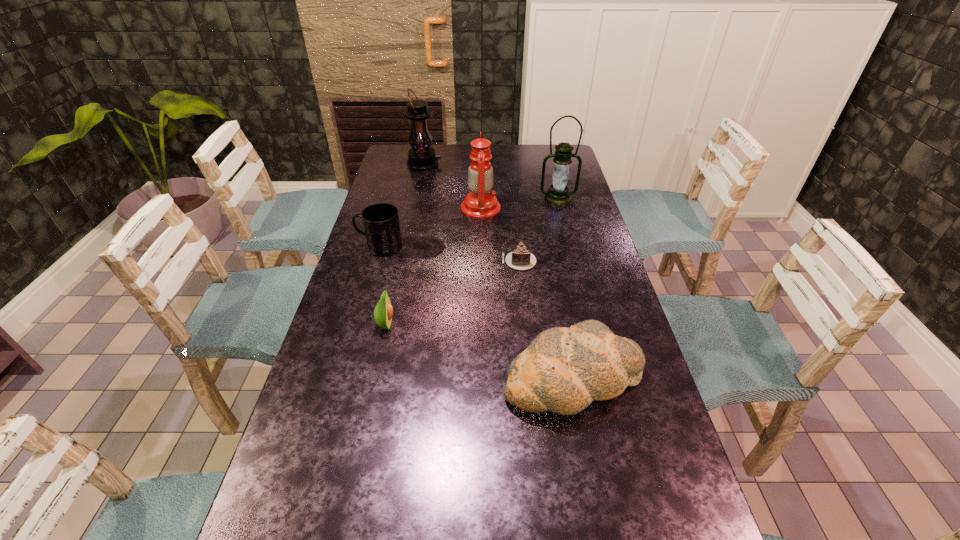
Locate an element on the screen. The height and width of the screenshot is (540, 960). vacant point located between the right lantern and the chocolate cake is located at coordinates (539, 230).

Choose which object is the fourth nearest neighbor to the mug. Please provide its 2D coordinates. Your answer should be formatted as a tuple, i.e. [(x, y)], where the tuple contains the x and y coordinates of a point satisfying the conditions above.

[(563, 370)]

Image resolution: width=960 pixels, height=540 pixels. In order to click on the third closest object to the oil lamp in this screenshot , I will do `click(381, 224)`.

The image size is (960, 540). Find the location of `vacant region that satisfies the following two spatial constraints: 1. on the back side of the chocolate cake; 2. above the farthest object, indicating its light source`. vacant region that satisfies the following two spatial constraints: 1. on the back side of the chocolate cake; 2. above the farthest object, indicating its light source is located at coordinates (509, 164).

Identify the location of vacant area in the image that satisfies the following two spatial constraints: 1. on the side where the nearer lantern emits light; 2. on the side of the mug with the handle. Image resolution: width=960 pixels, height=540 pixels. (570, 247).

Where is `vacant point that satisfies the following two spatial constraints: 1. on the front side of the bread; 2. on the right side of the oil lamp`? Image resolution: width=960 pixels, height=540 pixels. vacant point that satisfies the following two spatial constraints: 1. on the front side of the bread; 2. on the right side of the oil lamp is located at coordinates (481, 378).